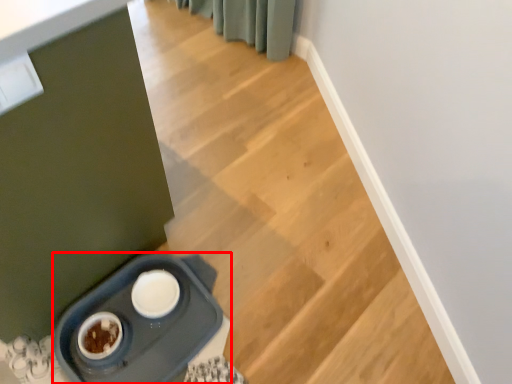
Question: In this image, where is appliance (annotated by the red box) located relative to stairs?

Choices:
 (A) right
 (B) left

Answer: (A)